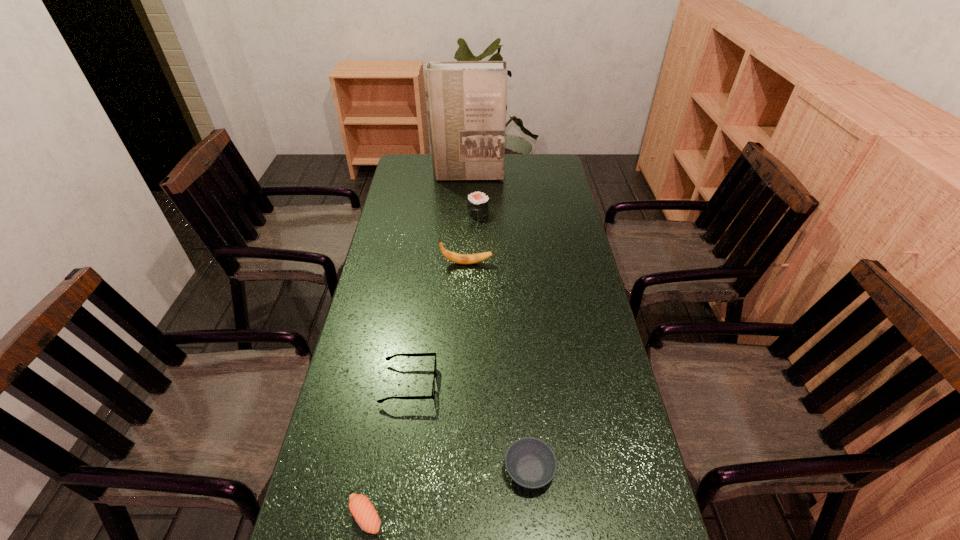
Where is `phonebook`? phonebook is located at coordinates (466, 100).

Where is `the farthest object`? The width and height of the screenshot is (960, 540). the farthest object is located at coordinates (466, 100).

Find the location of a particular element. The width and height of the screenshot is (960, 540). the fourth nearest object is located at coordinates (458, 258).

Find the location of a particular element. the second tallest object is located at coordinates (458, 258).

The height and width of the screenshot is (540, 960). I want to click on the third tallest object, so click(x=477, y=203).

The height and width of the screenshot is (540, 960). I want to click on the fifth nearest object, so click(477, 203).

Find the location of a particular element. the left sushi is located at coordinates (361, 508).

Where is `the nearest object`? This screenshot has width=960, height=540. the nearest object is located at coordinates (361, 508).

This screenshot has height=540, width=960. In order to click on the third nearest object in this screenshot , I will do `click(408, 354)`.

The image size is (960, 540). Find the location of `the second nearest object`. the second nearest object is located at coordinates (531, 463).